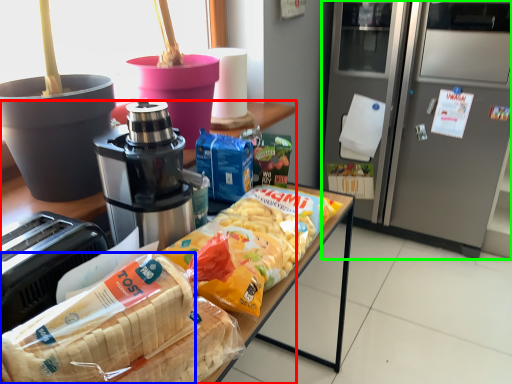
Question: Which object is the closest to the cabinetry (highlighted by a red box)? Choose among these: cereal (highlighted by a blue box) or home appliance (highlighted by a green box).

Choices:
 (A) cereal
 (B) home appliance

Answer: (A)